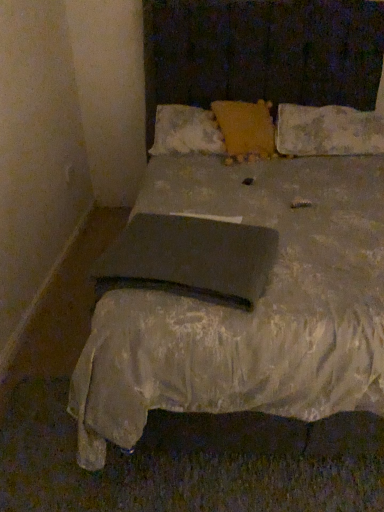
What is the approximate height of matte black pad at center?

It is 3.29 inches.

Describe the element at coordinates (328, 131) in the screenshot. I see `worn fabric pillow at upper right, positioned as the 1th pillow in right-to-left order` at that location.

This screenshot has height=512, width=384. Identify the location of yellow textured pillow at center, which appears as the third pillow when viewed from the right. (186, 131).

Measure the distance between point (227, 121) and camera.

Point (227, 121) is 2.41 meters from camera.

Where is `fluffy yellow pillow at center, the second pillow viewed from the left`? fluffy yellow pillow at center, the second pillow viewed from the left is located at coordinates (245, 128).

The image size is (384, 512). In order to click on matte black pad at center in this screenshot , I will do `click(190, 259)`.

Is worn fabric pillow at upper right, positioned as the third pillow in left-to-right order, aimed at matte black pad at center?

Yes, worn fabric pillow at upper right, positioned as the third pillow in left-to-right order, is aimed at matte black pad at center.

This screenshot has height=512, width=384. I want to click on pillow that is the 2nd one when counting backward from the matte black pad at center, so pyautogui.click(x=328, y=131).

Considering the positions of objects worn fabric pillow at upper right, positioned as the 1th pillow in right-to-left order, and matte black pad at center in the image provided, who is more to the left, worn fabric pillow at upper right, positioned as the 1th pillow in right-to-left order, or matte black pad at center?

Positioned to the left is matte black pad at center.

Find the location of a particular element. the 3rd pillow above the matte black pad at center (from a real-world perspective) is located at coordinates (245, 128).

Which object is closer to the camera taking this photo, fluffy yellow pillow at center, the second pillow viewed from the left, or matte black pad at center?

matte black pad at center is more forward.

Considering the relative sizes of fluffy yellow pillow at center, positioned as the second pillow in right-to-left order, and matte black pad at center in the image provided, is fluffy yellow pillow at center, positioned as the second pillow in right-to-left order, taller than matte black pad at center?

Correct, fluffy yellow pillow at center, positioned as the second pillow in right-to-left order, is much taller as matte black pad at center.

From a real-world perspective, is fluffy yellow pillow at center, positioned as the second pillow in right-to-left order, positioned above or below matte black pad at center?

Clearly, from a real-world perspective, fluffy yellow pillow at center, positioned as the second pillow in right-to-left order, is above matte black pad at center.

In the scene shown: Is matte black pad at center in contact with yellow textured pillow at center, the first pillow viewed from the left?

They are not placed beside each other.

In the scene shown: Is matte black pad at center oriented towards yellow textured pillow at center, the first pillow viewed from the left?

No, matte black pad at center is not aimed at yellow textured pillow at center, the first pillow viewed from the left.

Which of these two, matte black pad at center or yellow textured pillow at center, which appears as the third pillow when viewed from the right, is thinner?

With smaller width is yellow textured pillow at center, which appears as the third pillow when viewed from the right.

Can you confirm if matte black pad at center is shorter than yellow textured pillow at center, the first pillow viewed from the left?

Yes.

In the scene shown: Looking at the image, does yellow textured pillow at center, which appears as the third pillow when viewed from the right, seem bigger or smaller compared to worn fabric pillow at upper right, positioned as the third pillow in left-to-right order?

Considering their sizes, yellow textured pillow at center, which appears as the third pillow when viewed from the right, takes up less space than worn fabric pillow at upper right, positioned as the third pillow in left-to-right order.

Identify the location of the 1st pillow in front of the yellow textured pillow at center, which appears as the third pillow when viewed from the right, counting from the anchor's position. Image resolution: width=384 pixels, height=512 pixels. (328, 131).

Who is more distant, yellow textured pillow at center, which appears as the third pillow when viewed from the right, or worn fabric pillow at upper right, positioned as the third pillow in left-to-right order?

yellow textured pillow at center, which appears as the third pillow when viewed from the right, is further away from the camera.

Between fluffy yellow pillow at center, the second pillow viewed from the left, and yellow textured pillow at center, the first pillow viewed from the left, which one has larger size?

Bigger between the two is yellow textured pillow at center, the first pillow viewed from the left.

Looking at this image, would you say fluffy yellow pillow at center, positioned as the second pillow in right-to-left order, is to the left or to the right of yellow textured pillow at center, which appears as the third pillow when viewed from the right, in the picture?

In the image, fluffy yellow pillow at center, positioned as the second pillow in right-to-left order, appears on the right side of yellow textured pillow at center, which appears as the third pillow when viewed from the right.

Is point (237, 158) less distant than point (199, 132)?

Yes, it is in front of point (199, 132).

Considering the sizes of objects matte black pad at center and worn fabric pillow at upper right, positioned as the third pillow in left-to-right order, in the image provided, who is smaller, matte black pad at center or worn fabric pillow at upper right, positioned as the third pillow in left-to-right order,?

Smaller between the two is matte black pad at center.

Image resolution: width=384 pixels, height=512 pixels. I want to click on pad located on the left of worn fabric pillow at upper right, positioned as the third pillow in left-to-right order, so click(190, 259).

What's the angular difference between matte black pad at center and worn fabric pillow at upper right, positioned as the 1th pillow in right-to-left order,'s facing directions?

matte black pad at center and worn fabric pillow at upper right, positioned as the 1th pillow in right-to-left order, are facing 16.7 degrees away from each other.

Is matte black pad at center oriented away from worn fabric pillow at upper right, positioned as the third pillow in left-to-right order?

Yes.

The height and width of the screenshot is (512, 384). Find the location of `pad located underneath the yellow textured pillow at center, the first pillow viewed from the left (from a real-world perspective)`. pad located underneath the yellow textured pillow at center, the first pillow viewed from the left (from a real-world perspective) is located at coordinates (190, 259).

From the picture: From a real-world perspective, is yellow textured pillow at center, the first pillow viewed from the left, positioned under matte black pad at center based on gravity?

No.

From the image's perspective, is yellow textured pillow at center, which appears as the third pillow when viewed from the right, on matte black pad at center?

Correct, yellow textured pillow at center, which appears as the third pillow when viewed from the right, appears higher than matte black pad at center in the image.

Which of these two, yellow textured pillow at center, the first pillow viewed from the left, or matte black pad at center, is smaller?

With smaller size is matte black pad at center.

This screenshot has width=384, height=512. Find the location of `pad in front of the worn fabric pillow at upper right, positioned as the 1th pillow in right-to-left order`. pad in front of the worn fabric pillow at upper right, positioned as the 1th pillow in right-to-left order is located at coordinates (190, 259).

You are a GUI agent. You are given a task and a screenshot of the screen. Output one action in this format:
    pyautogui.click(x=<x>, y=<y>)
    Task: Click on the 2nd pillow to the right when counting from the matte black pad at center
    
    Given the screenshot: What is the action you would take?
    pyautogui.click(x=245, y=128)

Looking at the image, which one is located closer to yellow textured pillow at center, the first pillow viewed from the left, matte black pad at center or worn fabric pillow at upper right, positioned as the third pillow in left-to-right order?

worn fabric pillow at upper right, positioned as the third pillow in left-to-right order, lies closer to yellow textured pillow at center, the first pillow viewed from the left, than the other object.

From the image, which object appears to be farther from worn fabric pillow at upper right, positioned as the 1th pillow in right-to-left order, matte black pad at center or fluffy yellow pillow at center, positioned as the second pillow in right-to-left order?

matte black pad at center lies further to worn fabric pillow at upper right, positioned as the 1th pillow in right-to-left order, than the other object.

Looking at the image, which one is located further to yellow textured pillow at center, the first pillow viewed from the left, worn fabric pillow at upper right, positioned as the third pillow in left-to-right order, or matte black pad at center?

matte black pad at center lies further to yellow textured pillow at center, the first pillow viewed from the left, than the other object.

From the image, which object appears to be nearer to fluffy yellow pillow at center, the second pillow viewed from the left, yellow textured pillow at center, the first pillow viewed from the left, or worn fabric pillow at upper right, positioned as the third pillow in left-to-right order?

yellow textured pillow at center, the first pillow viewed from the left, is positioned closer to the anchor fluffy yellow pillow at center, the second pillow viewed from the left.

Estimate the real-world distances between objects in this image. Which object is closer to yellow textured pillow at center, the first pillow viewed from the left, worn fabric pillow at upper right, positioned as the 1th pillow in right-to-left order, or fluffy yellow pillow at center, the second pillow viewed from the left?

Based on the image, fluffy yellow pillow at center, the second pillow viewed from the left, appears to be nearer to yellow textured pillow at center, the first pillow viewed from the left.

Looking at the image, which one is located further to yellow textured pillow at center, the first pillow viewed from the left, fluffy yellow pillow at center, positioned as the second pillow in right-to-left order, or matte black pad at center?

Among the two, matte black pad at center is located further to yellow textured pillow at center, the first pillow viewed from the left.

Looking at the image, which one is located closer to matte black pad at center, worn fabric pillow at upper right, positioned as the 1th pillow in right-to-left order, or fluffy yellow pillow at center, positioned as the second pillow in right-to-left order?

fluffy yellow pillow at center, positioned as the second pillow in right-to-left order, lies closer to matte black pad at center than the other object.

When comparing their distances from matte black pad at center, does fluffy yellow pillow at center, positioned as the second pillow in right-to-left order, or yellow textured pillow at center, which appears as the third pillow when viewed from the right, seem closer?

fluffy yellow pillow at center, positioned as the second pillow in right-to-left order.

You are a GUI agent. You are given a task and a screenshot of the screen. Output one action in this format:
    pyautogui.click(x=<x>, y=<y>)
    Task: Click on the pillow between matte black pad at center and worn fabric pillow at upper right, positioned as the third pillow in left-to-right order, in the front-back direction
    The image size is (384, 512).
    Given the screenshot: What is the action you would take?
    pyautogui.click(x=245, y=128)

Locate an element on the screen. The width and height of the screenshot is (384, 512). pillow between yellow textured pillow at center, which appears as the third pillow when viewed from the right, and worn fabric pillow at upper right, positioned as the third pillow in left-to-right order is located at coordinates (245, 128).